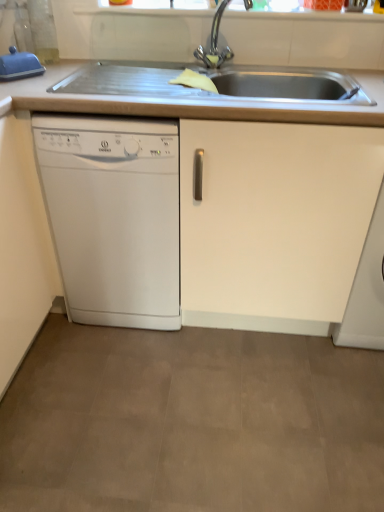
Question: In terms of width, does blue rubber glove at upper left look wider or thinner when compared to polished chrome tap at upper center?

Choices:
 (A) wide
 (B) thin

Answer: (B)

Question: Considering their positions, is blue rubber glove at upper left located in front of or behind polished chrome tap at upper center?

Choices:
 (A) front
 (B) behind

Answer: (B)

Question: Which of these objects is positioned farthest from the white matte cabinet at lower right?

Choices:
 (A) white matte countertop at upper center
 (B) white plastic dishwasher at left
 (C) blue rubber glove at upper left
 (D) polished chrome tap at upper center

Answer: (C)

Question: Based on their relative distances, which object is farther from the white matte cabinet at lower right?

Choices:
 (A) polished chrome tap at upper center
 (B) white plastic dishwasher at left
 (C) blue rubber glove at upper left
 (D) white matte countertop at upper center

Answer: (C)